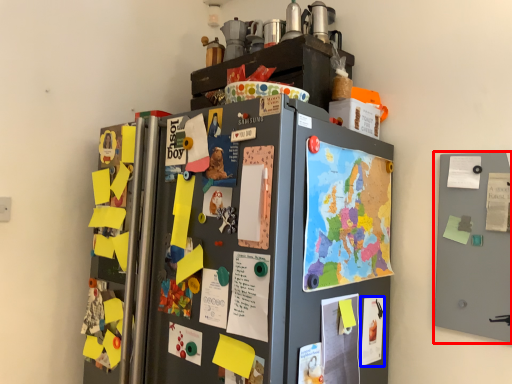
Question: Which of the following is the closest to the observer, door (highlighted by a red box) or poster (highlighted by a blue box)?

Choices:
 (A) door
 (B) poster

Answer: (A)